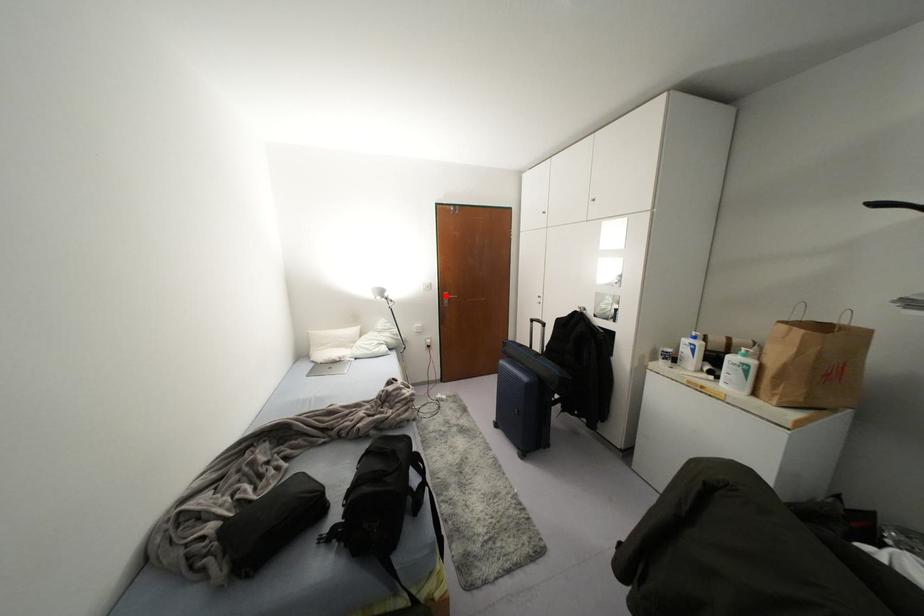
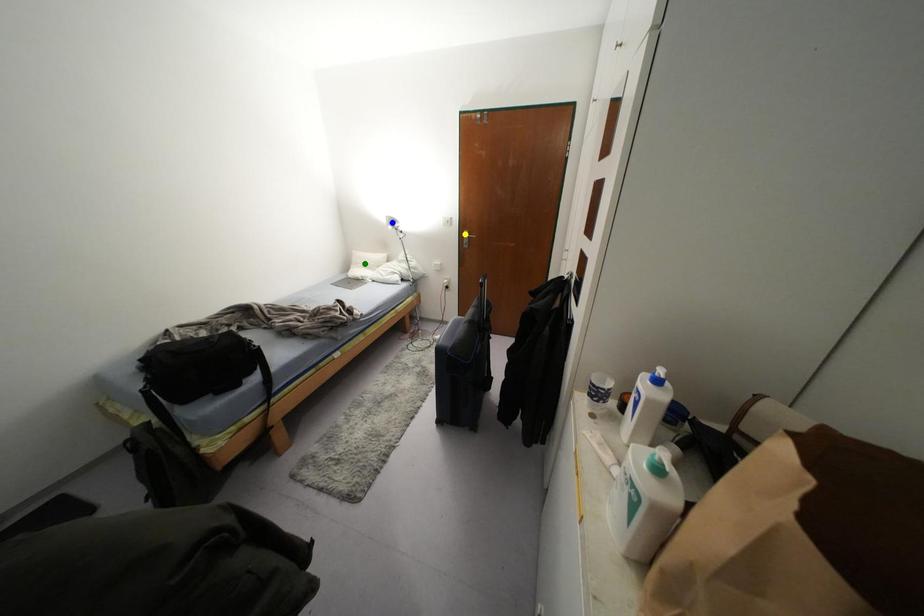
Question: I am providing you with two images of the same scene from different viewpoints. A red point is marked on the first image. You are given multiple points on the second image. Which point in image 2 represents the same 3d spot as the red point in image 1?

Choices:
 (A) blue point
 (B) yellow point
 (C) green point

Answer: (B)